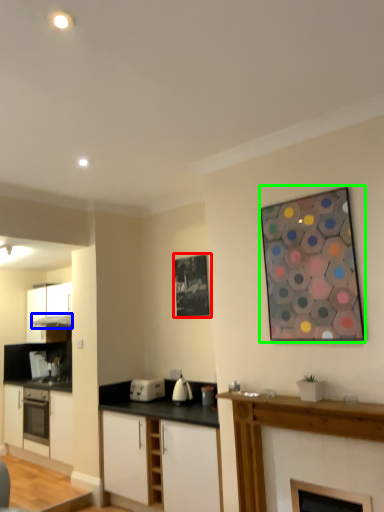
Question: Which object is the farthest from picture frame (highlighted by a red box)? Choose among these: exhaust hood (highlighted by a blue box) or picture frame (highlighted by a green box).

Choices:
 (A) exhaust hood
 (B) picture frame

Answer: (A)